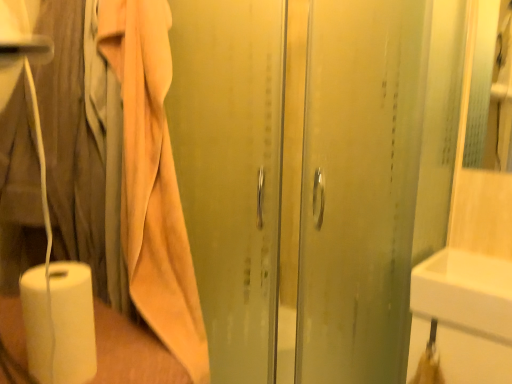
Question: From a real-world perspective, is beige cotton bath towel at left positioned above or below white glossy sink at lower right?

Choices:
 (A) below
 (B) above

Answer: (B)

Question: Which is correct: beige cotton bath towel at left is inside white glossy sink at lower right, or outside of it?

Choices:
 (A) outside
 (B) inside

Answer: (A)

Question: Estimate the real-world distances between objects in this image. Which object is farther from the beige cotton bath towel at left?

Choices:
 (A) white matte paper towel at lower left
 (B) transparent glass shower door at center
 (C) white glossy sink at lower right

Answer: (C)

Question: Estimate the real-world distances between objects in this image. Which object is closer to the white matte paper towel at lower left?

Choices:
 (A) white glossy sink at lower right
 (B) beige cotton bath towel at left
 (C) transparent glass shower door at center

Answer: (B)